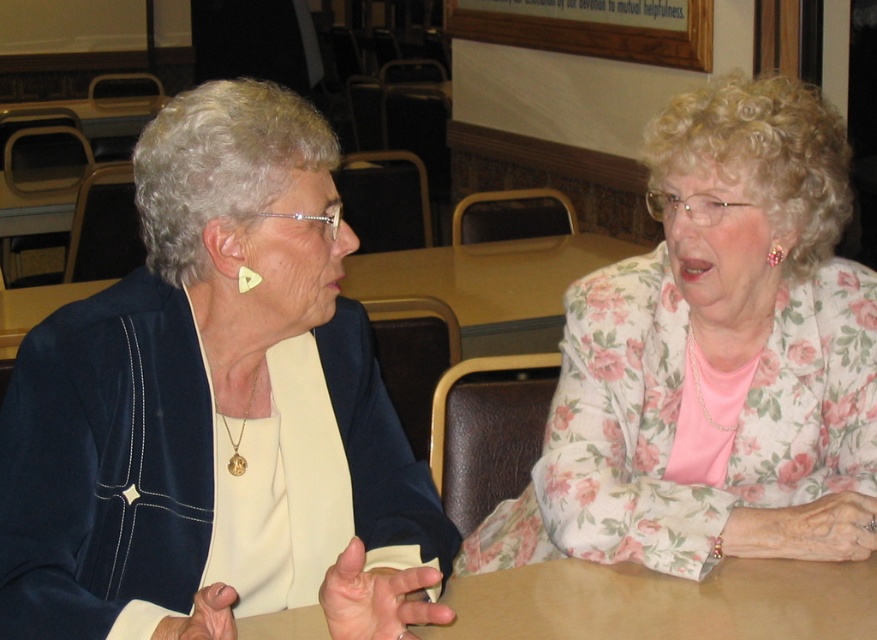
Where is `floral fabric blouse at center`? This screenshot has height=640, width=877. floral fabric blouse at center is located at coordinates (714, 358).

Does floral fabric blouse at center have a smaller size compared to brown wooden table at center?

No.

Does point (761, 209) come farther from viewer compared to point (695, 596)?

Yes.

Locate an element on the screen. This screenshot has width=877, height=640. floral fabric blouse at center is located at coordinates (714, 358).

Is matte black jacket at left positioned in front of brown wooden table at center?

Yes.

Does matte black jacket at left come behind brown wooden table at center?

No, it is not.

Locate an element on the screen. matte black jacket at left is located at coordinates (214, 408).

Does matte black jacket at left appear under floral fabric blouse at center?

No.

Between point (27, 636) and point (647, 141), which one is positioned behind?

The point (647, 141) is more distant.

Is point (296, 513) positioned before point (717, 141)?

That is True.

This screenshot has width=877, height=640. Find the location of `matte black jacket at left`. matte black jacket at left is located at coordinates (214, 408).